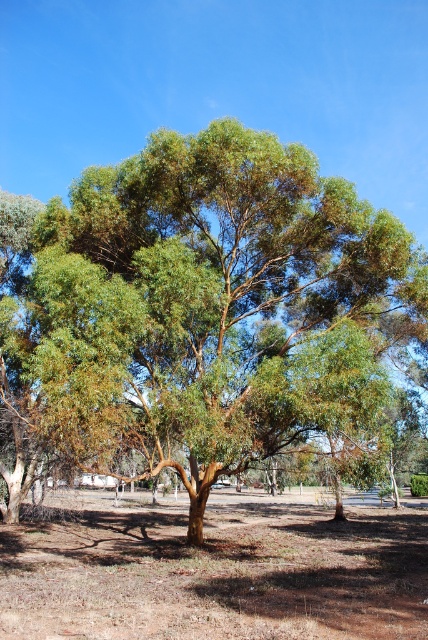
Question: Where is green rough bark tree at center located in relation to brown dry soil at center in the image?

Choices:
 (A) below
 (B) above

Answer: (B)

Question: Is green rough bark tree at center positioned behind brown dry soil at center?

Choices:
 (A) no
 (B) yes

Answer: (B)

Question: Which point is farther to the camera?

Choices:
 (A) brown dry soil at center
 (B) green rough bark tree at center

Answer: (B)

Question: In this image, where is green rough bark tree at center located relative to brown dry soil at center?

Choices:
 (A) below
 (B) above

Answer: (B)